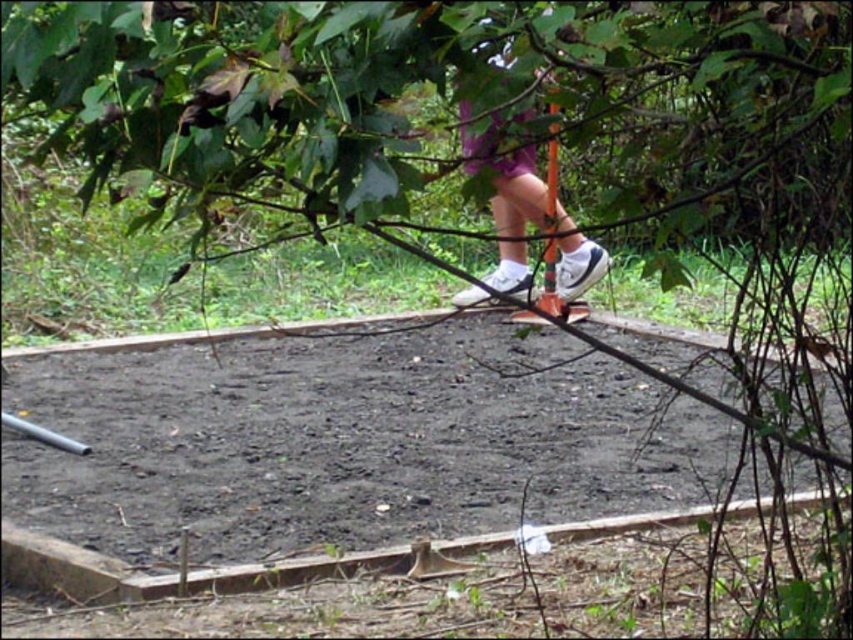
You are a park visitor trying to find the best spot to watch someone slacklining. You see the dark brown soil at center and the purple fabric shorts at center. Which object is closer to the ground?

The dark brown soil at center is located below purple fabric shorts at center, so the dark brown soil at center is closer to the ground.

You are designing a safety mat for the person slacklining. The mat needs to cover the area directly under the rope where the person might fall. Based on the image, which object should the mat be sized to accommodate, the dark brown soil at center or the purple fabric shorts at center?

The dark brown soil at center is bigger than the purple fabric shorts at center, so the mat should be sized to accommodate the dark brown soil at center to ensure coverage of the larger area.